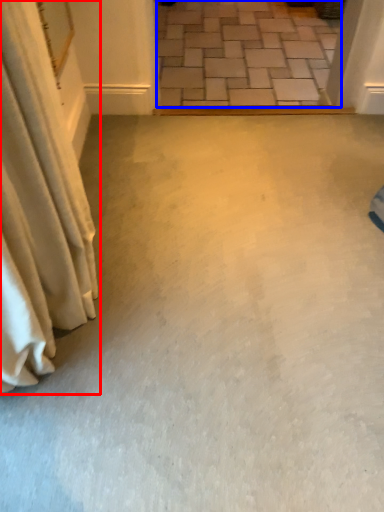
Question: Which object appears closest to the camera in this image, curtain (highlighted by a red box) or concrete (highlighted by a blue box)?

Choices:
 (A) curtain
 (B) concrete

Answer: (A)